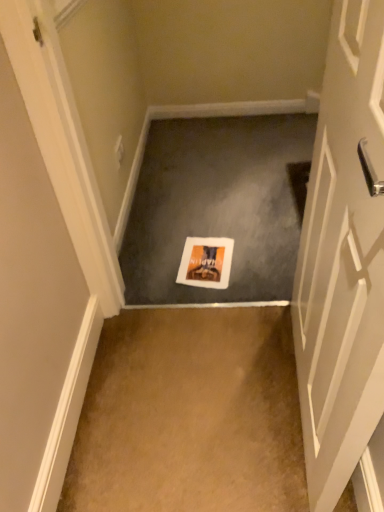
Question: Considering the relative sizes of white glossy door at center right and orange matte postcard at center in the image provided, is white glossy door at center right bigger than orange matte postcard at center?

Choices:
 (A) yes
 (B) no

Answer: (A)

Question: Is the position of white glossy door at center right more distant than that of orange matte postcard at center?

Choices:
 (A) yes
 (B) no

Answer: (B)

Question: Is white glossy door at center right turned away from orange matte postcard at center?

Choices:
 (A) yes
 (B) no

Answer: (B)

Question: Considering the relative sizes of white glossy door at center right and orange matte postcard at center in the image provided, is white glossy door at center right thinner than orange matte postcard at center?

Choices:
 (A) yes
 (B) no

Answer: (A)

Question: Is white glossy door at center right smaller than orange matte postcard at center?

Choices:
 (A) no
 (B) yes

Answer: (A)

Question: Is white paper at center, the 2th concrete positioned from the bottom, taller or shorter than orange matte postcard at center?

Choices:
 (A) tall
 (B) short

Answer: (A)

Question: Considering the positions of point (253, 221) and point (205, 242), is point (253, 221) closer or farther from the camera than point (205, 242)?

Choices:
 (A) farther
 (B) closer

Answer: (A)

Question: In the image, is white paper at center, which appears as the 1th concrete when viewed from the back, positioned in front of or behind orange matte postcard at center?

Choices:
 (A) behind
 (B) front

Answer: (B)

Question: Is white paper at center, the 2th concrete positioned from the bottom, bigger or smaller than orange matte postcard at center?

Choices:
 (A) small
 (B) big

Answer: (B)

Question: Based on their sizes in the image, would you say brown carpet at center, marked as the first concrete in a bottom-to-top arrangement, is bigger or smaller than orange matte postcard at center?

Choices:
 (A) big
 (B) small

Answer: (A)

Question: Considering the positions of brown carpet at center, marked as the first concrete in a bottom-to-top arrangement, and orange matte postcard at center in the image, is brown carpet at center, marked as the first concrete in a bottom-to-top arrangement, taller or shorter than orange matte postcard at center?

Choices:
 (A) short
 (B) tall

Answer: (B)

Question: Considering their positions, is brown carpet at center, marked as the first concrete in a bottom-to-top arrangement, located in front of or behind orange matte postcard at center?

Choices:
 (A) front
 (B) behind

Answer: (A)

Question: Do you think brown carpet at center, which is counted as the 2th concrete, starting from the top, is within orange matte postcard at center, or outside of it?

Choices:
 (A) inside
 (B) outside

Answer: (B)

Question: Considering the positions of point (127, 500) and point (144, 256), is point (127, 500) closer or farther from the camera than point (144, 256)?

Choices:
 (A) closer
 (B) farther

Answer: (A)

Question: Is brown carpet at center, marked as the first concrete in a bottom-to-top arrangement, bigger or smaller than white paper at center, the 2th concrete positioned from the bottom?

Choices:
 (A) big
 (B) small

Answer: (B)